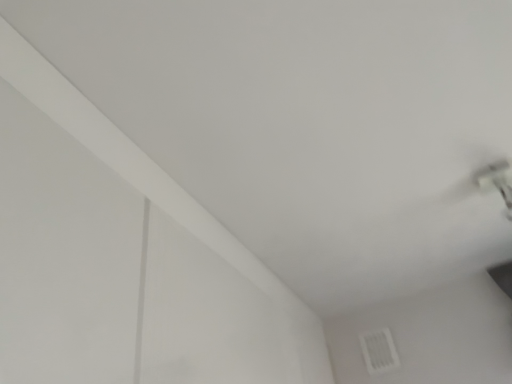
Describe the element at coordinates (497, 180) in the screenshot. I see `white plastic lamp at upper right` at that location.

Where is `white plastic lamp at upper right`? white plastic lamp at upper right is located at coordinates (497, 180).

What is the approximate width of white plastic lamp at upper right?

The width of white plastic lamp at upper right is 10.25 centimeters.

This screenshot has height=384, width=512. I want to click on white plastic lamp at upper right, so click(x=497, y=180).